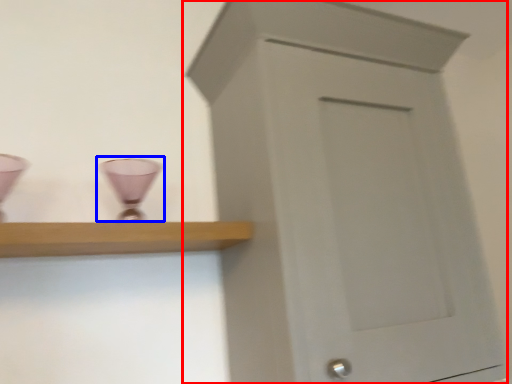
Question: Which object appears farthest to the camera in this image, cupboard (highlighted by a red box) or candle holder (highlighted by a blue box)?

Choices:
 (A) cupboard
 (B) candle holder

Answer: (B)